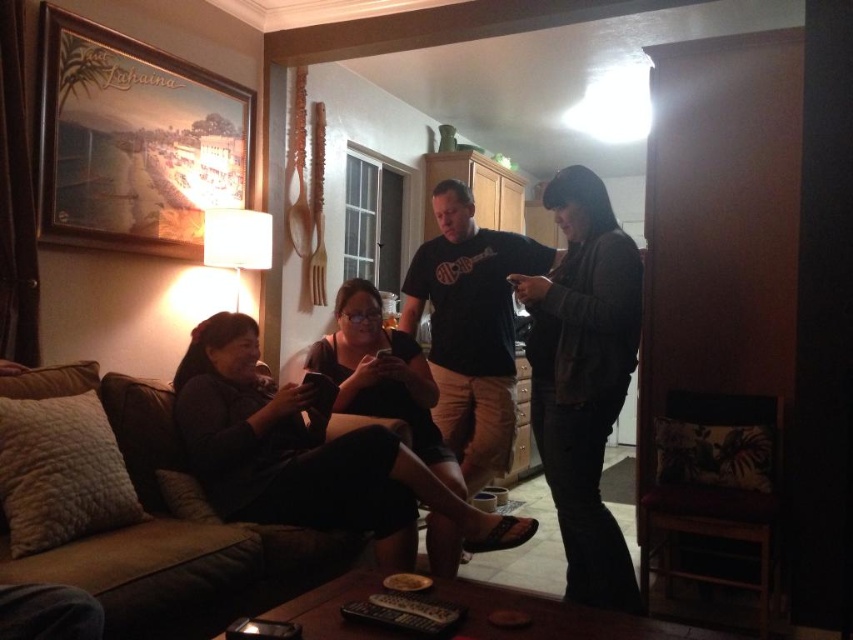
Does point (352, 452) come in front of point (634, 244)?

Yes.

Does dark gray fabric couch at lower left appear under dark gray sweater at center?

Yes, dark gray fabric couch at lower left is below dark gray sweater at center.

Where is `dark gray fabric couch at lower left`? The width and height of the screenshot is (853, 640). dark gray fabric couch at lower left is located at coordinates (315, 458).

I want to click on dark gray fabric couch at lower left, so click(x=315, y=458).

Is point (376, 506) less distant than point (457, 328)?

Yes, it is in front of point (457, 328).

Which is behind, point (328, 520) or point (512, 401)?

Positioned behind is point (512, 401).

Locate an element on the screen. dark gray fabric couch at lower left is located at coordinates (315, 458).

Consider the image. Who is positioned more to the right, dark gray sweater at center or black cotton t-shirt at center?

Positioned to the right is dark gray sweater at center.

Who is more distant from viewer, (573, 552) or (509, 353)?

The point (509, 353) is more distant.

At what (x,y) coordinates should I click in order to perform the action: click on dark gray sweater at center. Please return your answer as a coordinate pair (x, y). Image resolution: width=853 pixels, height=640 pixels. Looking at the image, I should click on (583, 378).